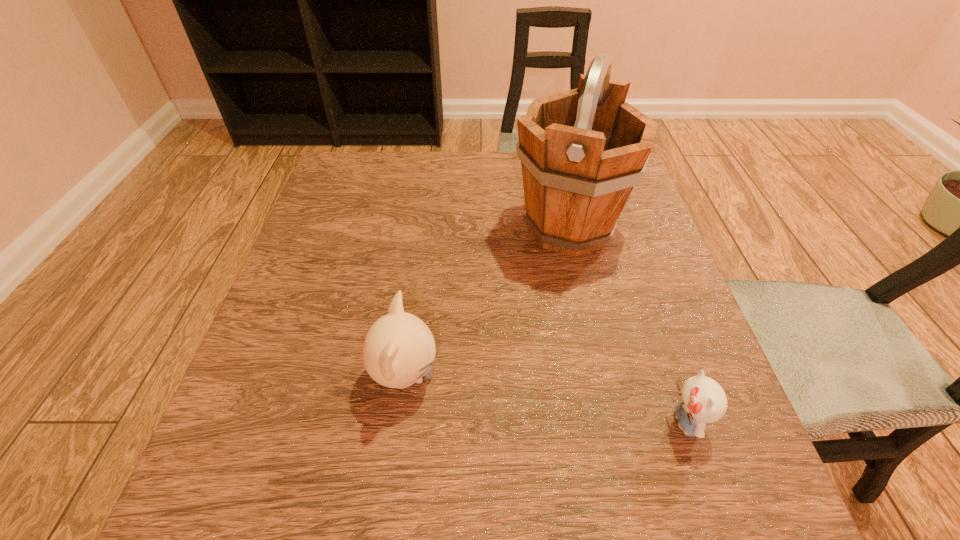
Locate an element on the screen. free location located 0.070m on the front-facing side of the shortest object is located at coordinates (622, 422).

This screenshot has height=540, width=960. I want to click on object present at the far edge, so click(x=582, y=151).

Identify the location of bucket located at the right edge. Image resolution: width=960 pixels, height=540 pixels. (582, 151).

At what (x,y) coordinates should I click in order to perform the action: click on kitten that is at the right edge. Please return your answer as a coordinate pair (x, y). The image size is (960, 540). Looking at the image, I should click on (702, 400).

Locate an element on the screen. This screenshot has width=960, height=540. object that is at the far right corner is located at coordinates (582, 151).

In the image, there is a desktop. Identify the location of free space at the far edge. This screenshot has width=960, height=540. (437, 190).

The image size is (960, 540). I want to click on free region at the left edge, so click(x=318, y=373).

Identify the location of free space at the right edge of the desktop. (639, 350).

The height and width of the screenshot is (540, 960). I want to click on vacant space at the far left corner of the desktop, so (x=374, y=153).

In the image, there is a desktop. What are the coordinates of `vacant space at the near right corner` in the screenshot? It's located at (672, 513).